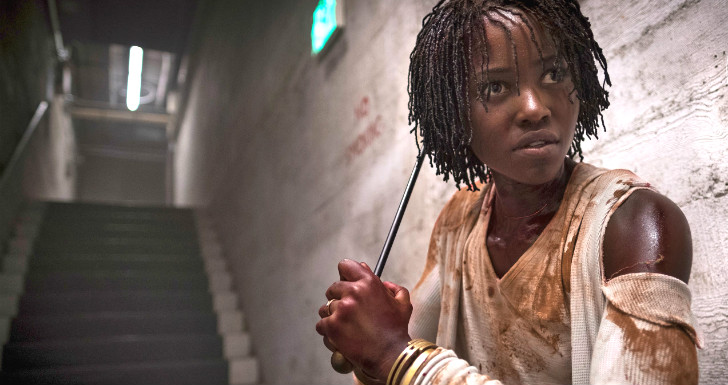
Identify the location of staircase. (76, 295).